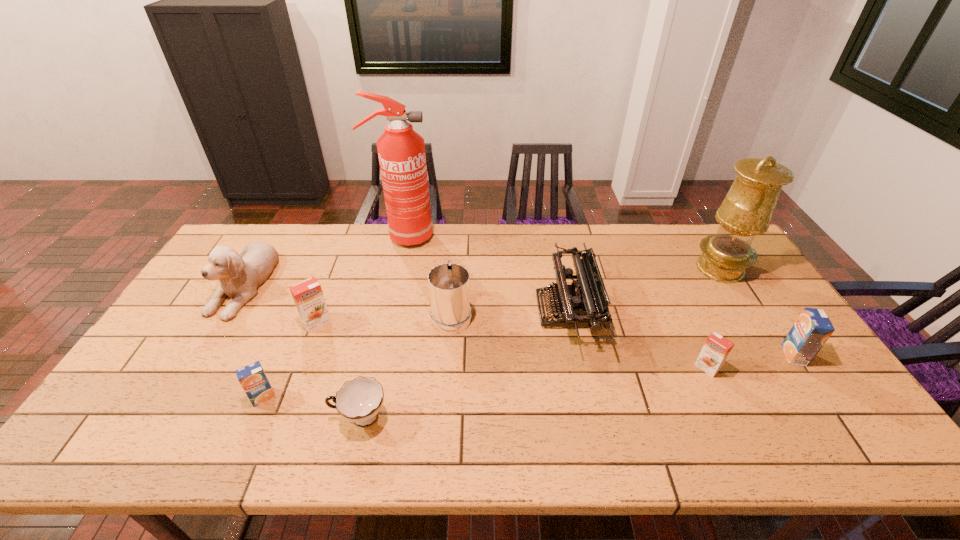
I want to click on empty location between the farthest orange_juice and the mug, so click(384, 318).

Locate an element on the screen. The image size is (960, 540). free area in between the farthest object and the left orange orange juice is located at coordinates (360, 280).

Locate an element on the screen. The image size is (960, 540). free space between the right orange orange juice and the cup is located at coordinates (534, 393).

Locate which object is the second closest to the fire extinguisher. Please provide its 2D coordinates. Your answer should be formatted as a tuple, i.e. [(x, y)], where the tuple contains the x and y coordinates of a point satisfying the conditions above.

[(240, 275)]

The height and width of the screenshot is (540, 960). I want to click on object that stands as the seventh closest to the mug, so click(x=716, y=349).

The image size is (960, 540). What are the coordinates of `orange_juice that stands as the second closest to the white cup` in the screenshot? It's located at (308, 296).

Select which orange_juice is the fourth closest to the mug. Please provide its 2D coordinates. Your answer should be formatted as a tuple, i.e. [(x, y)], where the tuple contains the x and y coordinates of a point satisfying the conditions above.

[(812, 329)]

This screenshot has width=960, height=540. I want to click on blank area in the image that satisfies the following two spatial constraints: 1. at the nozzle of the tallest object; 2. on the left side of the oil lamp, so click(x=396, y=268).

The width and height of the screenshot is (960, 540). What are the coordinates of `vacant space that satisfies the following two spatial constraints: 1. on the front-facing side of the puppy; 2. on the side of the cup with the handle` in the screenshot? It's located at (162, 417).

Where is `free space that satisfies the following two spatial constraints: 1. on the front-facing side of the smaller blue orange_juice; 2. on the left side of the puppy`? Image resolution: width=960 pixels, height=540 pixels. free space that satisfies the following two spatial constraints: 1. on the front-facing side of the smaller blue orange_juice; 2. on the left side of the puppy is located at coordinates (175, 397).